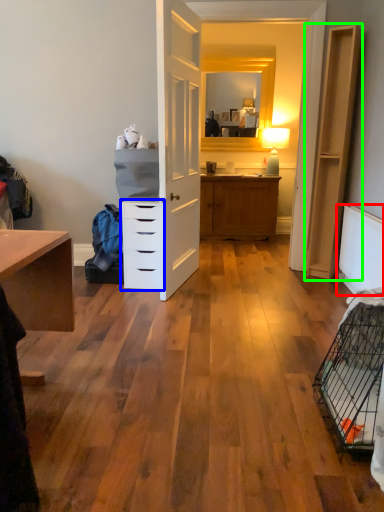
Question: Based on their relative distances, which object is nearer to radiator (highlighted by a red box)? Choose from chest of drawers (highlighted by a blue box) and file cabinet (highlighted by a green box).

Choices:
 (A) chest of drawers
 (B) file cabinet

Answer: (B)